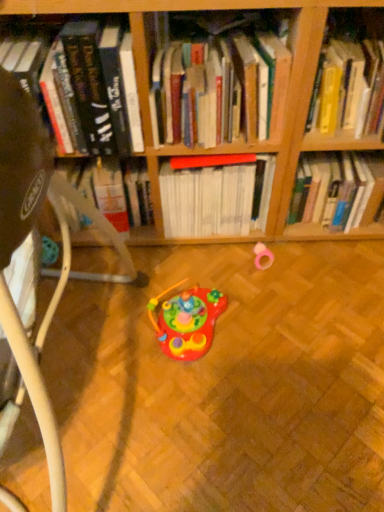
Question: From the image's perspective, would you say white plastic swivel chair at lower left is shown under red matte book at center, acting as the 2th book starting from the right?

Choices:
 (A) no
 (B) yes

Answer: (B)

Question: Is red matte book at center, acting as the 2th book starting from the right, a part of white plastic swivel chair at lower left?

Choices:
 (A) yes
 (B) no

Answer: (B)

Question: Is white plastic swivel chair at lower left positioned in front of red matte book at center, acting as the 2th book starting from the right?

Choices:
 (A) yes
 (B) no

Answer: (A)

Question: Considering the relative sizes of white plastic swivel chair at lower left and red matte book at center, which is the third book in left-to-right order, in the image provided, is white plastic swivel chair at lower left shorter than red matte book at center, which is the third book in left-to-right order,?

Choices:
 (A) yes
 (B) no

Answer: (B)

Question: Is white plastic swivel chair at lower left far from red matte book at center, which is the third book in left-to-right order?

Choices:
 (A) yes
 (B) no

Answer: (B)

Question: From the image's perspective, is red matte book at center, which is the third book in left-to-right order, positioned above or below hardcover books at center, which ranks as the 3th book in right-to-left order?

Choices:
 (A) below
 (B) above

Answer: (A)

Question: Relative to hardcover books at center, arranged as the 2th book when viewed from the left, is red matte book at center, which is the third book in left-to-right order, in front or behind?

Choices:
 (A) front
 (B) behind

Answer: (B)

Question: Which is correct: red matte book at center, acting as the 2th book starting from the right, is inside hardcover books at center, which ranks as the 3th book in right-to-left order, or outside of it?

Choices:
 (A) outside
 (B) inside

Answer: (A)

Question: Looking at the image, does red matte book at center, acting as the 2th book starting from the right, seem bigger or smaller compared to hardcover books at center, arranged as the 2th book when viewed from the left?

Choices:
 (A) small
 (B) big

Answer: (B)

Question: Does point (220, 308) appear closer or farther from the camera than point (11, 215)?

Choices:
 (A) farther
 (B) closer

Answer: (A)

Question: Based on their positions, is shiny plastic toy at center, which is counted as the 2th toy, starting from the top, located to the left or right of white plastic swivel chair at lower left?

Choices:
 (A) right
 (B) left

Answer: (A)

Question: From their relative heights in the image, would you say shiny plastic toy at center, which is the first toy in left-to-right order, is taller or shorter than white plastic swivel chair at lower left?

Choices:
 (A) short
 (B) tall

Answer: (A)

Question: From a real-world perspective, is shiny plastic toy at center, which is counted as the 2th toy, starting from the top, physically located above or below white plastic swivel chair at lower left?

Choices:
 (A) below
 (B) above

Answer: (A)

Question: From a real-world perspective, is hardcover books at center, arranged as the 2th book when viewed from the left, positioned above or below red matte book at center, acting as the 2th book starting from the right?

Choices:
 (A) above
 (B) below

Answer: (A)

Question: Is hardcover books at center, arranged as the 2th book when viewed from the left, bigger or smaller than red matte book at center, acting as the 2th book starting from the right?

Choices:
 (A) big
 (B) small

Answer: (B)